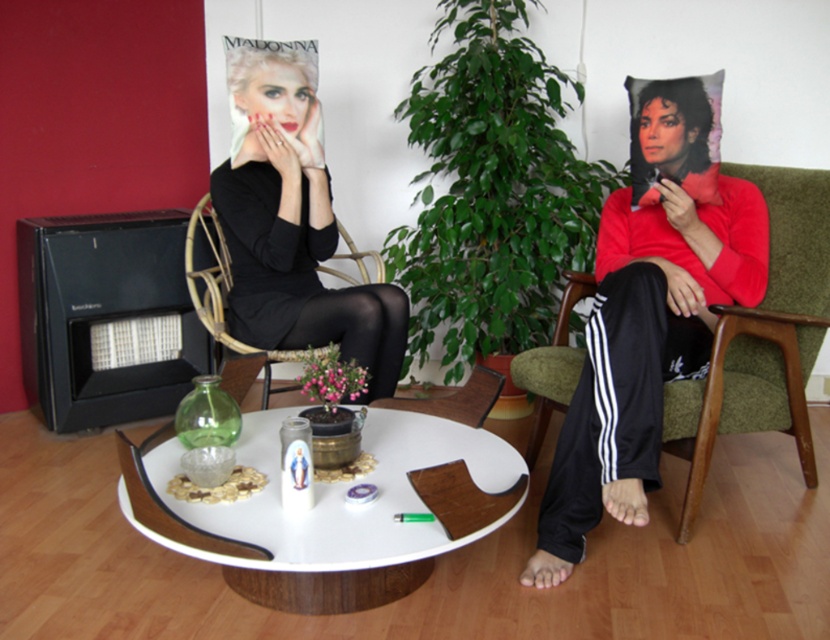
Question: In this image, where is white glossy round table at center located relative to green fabric armchair at right?

Choices:
 (A) above
 (B) below

Answer: (B)

Question: Can you confirm if black matte dress at center is positioned to the right of green fabric armchair at right?

Choices:
 (A) yes
 (B) no

Answer: (B)

Question: Is green fabric armchair at right positioned in front of woven rattan armchair at left?

Choices:
 (A) no
 (B) yes

Answer: (B)

Question: Which is nearer to the green fabric armchair at right?

Choices:
 (A) woven rattan armchair at left
 (B) black matte dress at center

Answer: (B)

Question: Which object is the farthest from the black matte dress at center?

Choices:
 (A) green fabric armchair at right
 (B) white glossy round table at center
 (C) woven rattan armchair at left

Answer: (A)

Question: Which of the following is the farthest from the observer?

Choices:
 (A) (242, 225)
 (B) (564, 273)

Answer: (B)